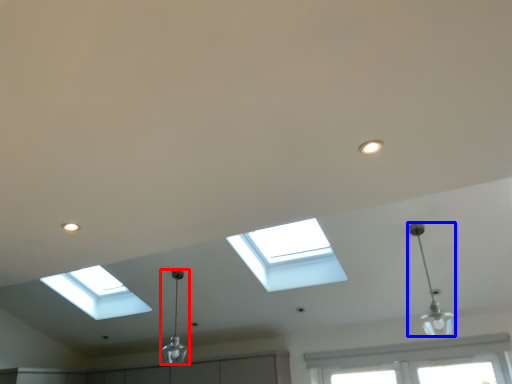
Question: Which of the following is the closest to the observer, lamp (highlighted by a red box) or lamp (highlighted by a blue box)?

Choices:
 (A) lamp
 (B) lamp

Answer: (B)